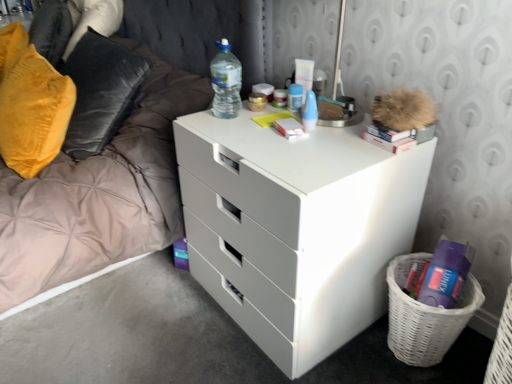
At what (x,y) coordinates should I click in order to perform the action: click on vacant space in between white matte chest of drawers at center and white wicker basket at lower right. Please return your answer as a coordinate pair (x, y). The image size is (512, 384). Looking at the image, I should click on (355, 365).